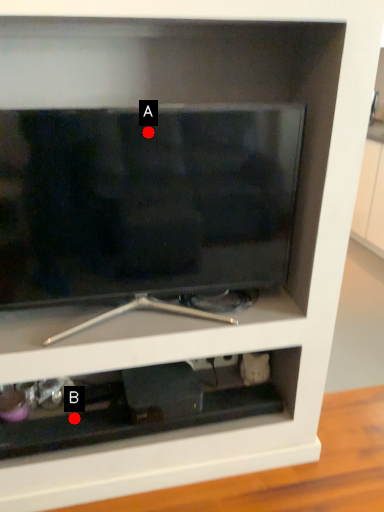
Question: Two points are circled on the image, labeled by A and B beside each circle. Which point is closer to the camera?

Choices:
 (A) A is closer
 (B) B is closer

Answer: (A)